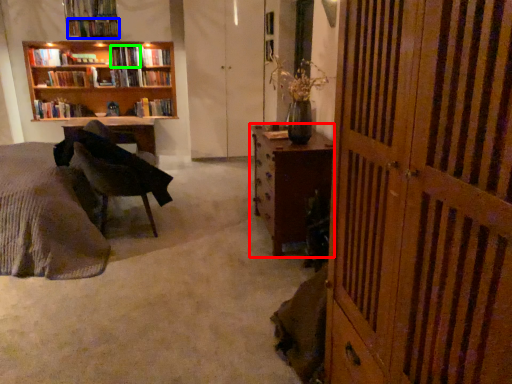
Question: Which object is the farthest from desk (highlighted by a red box)? Choose among these: book (highlighted by a blue box) or book (highlighted by a green box).

Choices:
 (A) book
 (B) book

Answer: (A)